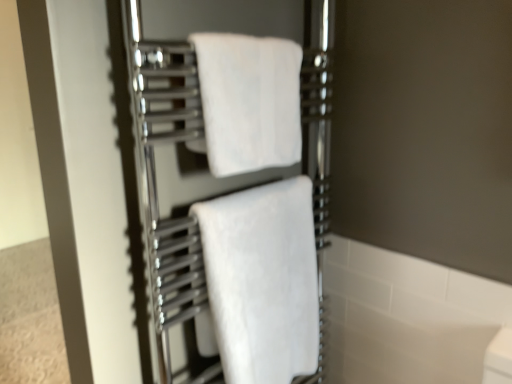
Question: Is white soft towel at center, positioned as the 1th towel in bottom-to-top order, to the left or to the right of white soft towel at center, the first towel viewed from the top, in the image?

Choices:
 (A) right
 (B) left

Answer: (A)

Question: Is white soft towel at center, which appears as the 2th towel when viewed from the top, inside the boundaries of white soft towel at center, the first towel viewed from the top, or outside?

Choices:
 (A) inside
 (B) outside

Answer: (B)

Question: Relative to white soft towel at center, the first towel viewed from the top, is white soft towel at center, positioned as the 1th towel in bottom-to-top order, in front or behind?

Choices:
 (A) behind
 (B) front

Answer: (A)

Question: Is point (245, 79) closer or farther from the camera than point (248, 286)?

Choices:
 (A) closer
 (B) farther

Answer: (A)

Question: Do you think white soft towel at center, the second towel from the bottom, is within white soft towel at center, positioned as the 1th towel in bottom-to-top order, or outside of it?

Choices:
 (A) inside
 (B) outside

Answer: (B)

Question: From a real-world perspective, relative to white soft towel at center, which appears as the 2th towel when viewed from the top, is white soft towel at center, the second towel from the bottom, vertically above or below?

Choices:
 (A) below
 (B) above

Answer: (B)

Question: Looking at their shapes, would you say white soft towel at center, the second towel from the bottom, is wider or thinner than white soft towel at center, which appears as the 2th towel when viewed from the top?

Choices:
 (A) wide
 (B) thin

Answer: (B)